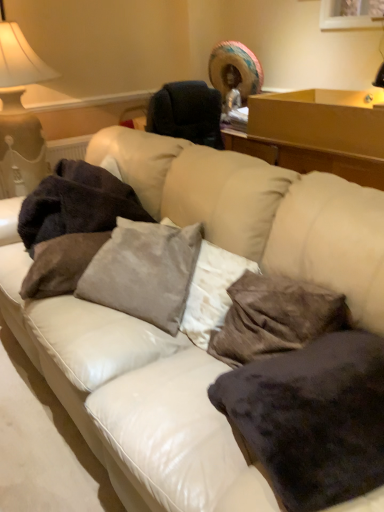
Question: Is velvety dark brown pillow at center, the 3th pillow from the left, bigger or smaller than matte white lampshade at upper left?

Choices:
 (A) big
 (B) small

Answer: (B)

Question: Considering their positions, is velvety dark brown pillow at center, which ranks as the 2th pillow in right-to-left order, located in front of or behind matte white lampshade at upper left?

Choices:
 (A) front
 (B) behind

Answer: (A)

Question: Which object is positioned farthest from the velvety dark brown pillow at center, which ranks as the 2th pillow in right-to-left order?

Choices:
 (A) wooden table at upper right
 (B) matte white lampshade at upper left
 (C) dark brown plush blanket at left
 (D) velvety dark brown pillow at lower right, which is the fourth pillow in left-to-right order
 (E) velvet gray pillow at center, which is the third pillow from right to left

Answer: (B)

Question: Estimate the real-world distances between objects in this image. Which object is closer to the matte white lampshade at upper left?

Choices:
 (A) velvety dark brown pillow at center, which ranks as the 2th pillow in right-to-left order
 (B) suede-like gray pillow at center, arranged as the 4th pillow when viewed from the right
 (C) wooden table at upper right
 (D) velvet gray pillow at center, positioned as the 2th pillow in left-to-right order
 (E) dark brown plush blanket at left

Answer: (E)